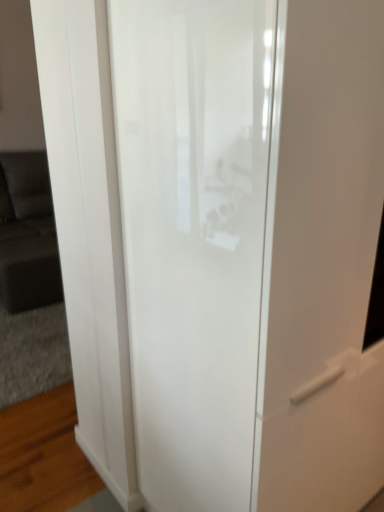
You are a GUI agent. You are given a task and a screenshot of the screen. Output one action in this format:
    pyautogui.click(x=<x>, y=<y>)
    Task: Click on the dark gray fabric armchair at left
    
    Given the screenshot: What is the action you would take?
    pyautogui.click(x=27, y=234)

This screenshot has width=384, height=512. What do you see at coordinates (27, 234) in the screenshot?
I see `dark gray fabric armchair at left` at bounding box center [27, 234].

The width and height of the screenshot is (384, 512). What are the coordinates of `dark gray fabric armchair at left` in the screenshot? It's located at (27, 234).